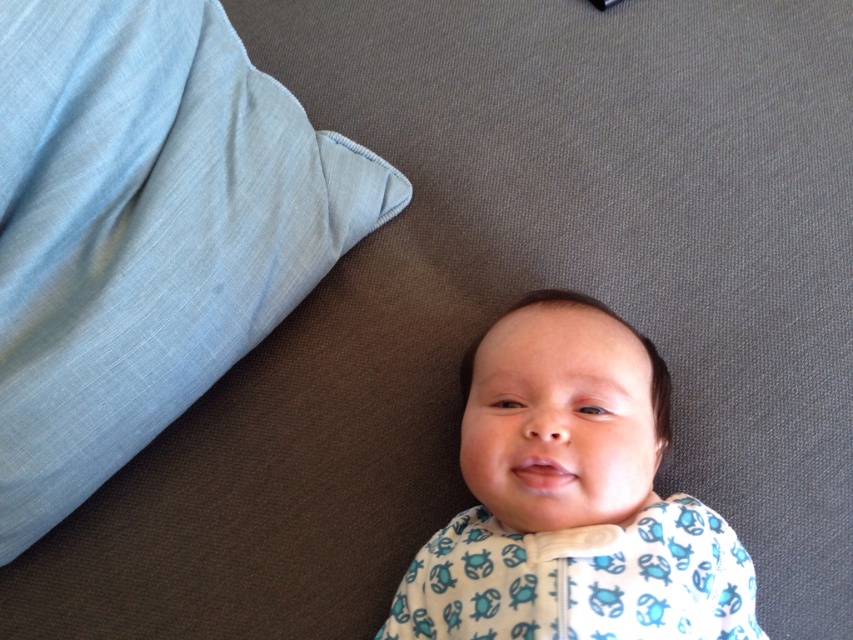
Can you confirm if light blue fabric at upper left is positioned below white soft fabric baby at center?

No, light blue fabric at upper left is not below white soft fabric baby at center.

Does light blue fabric at upper left have a larger size compared to white soft fabric baby at center?

Yes, light blue fabric at upper left is bigger than white soft fabric baby at center.

Locate an element on the screen. light blue fabric at upper left is located at coordinates (144, 230).